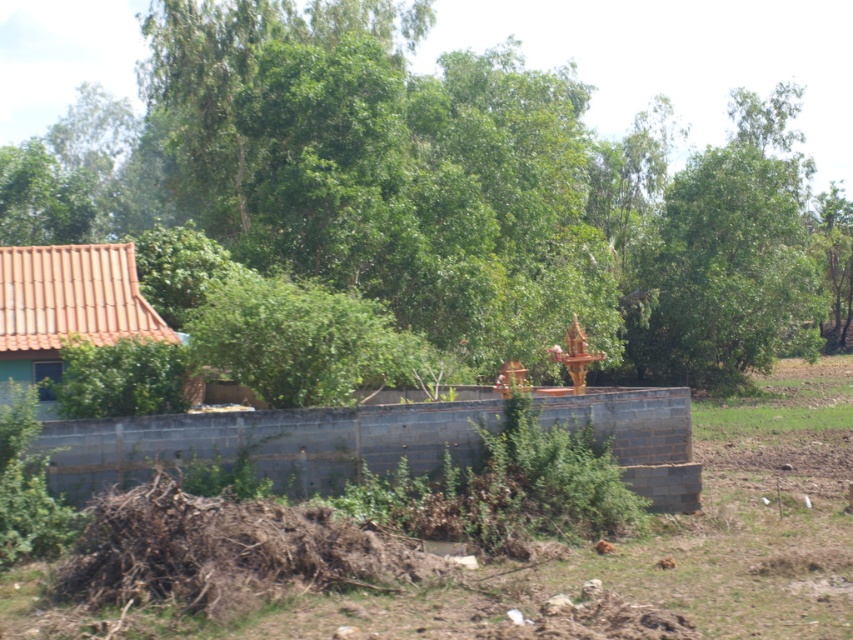
Question: Which point is farther to the camera?

Choices:
 (A) (706, 408)
 (B) (379, 168)
 (C) (10, 268)

Answer: (A)

Question: Can you confirm if brown soil at lower center is positioned below orange clay roof at left?

Choices:
 (A) no
 (B) yes

Answer: (B)

Question: Which object appears farthest from the camera in this image?

Choices:
 (A) green leafy tree at center
 (B) orange clay roof at left
 (C) brown soil at lower center

Answer: (A)

Question: Considering the relative positions of green leafy tree at center and brown soil at lower center in the image provided, where is green leafy tree at center located with respect to brown soil at lower center?

Choices:
 (A) above
 (B) below

Answer: (A)

Question: Estimate the real-world distances between objects in this image. Which object is farther from the brown soil at lower center?

Choices:
 (A) green leafy tree at center
 (B) orange clay roof at left

Answer: (A)

Question: Is green leafy tree at center closer to camera compared to brown soil at lower center?

Choices:
 (A) yes
 (B) no

Answer: (B)